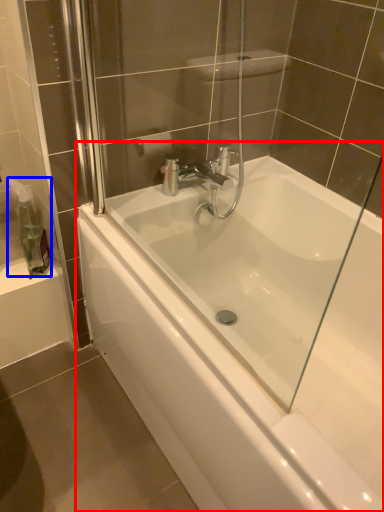
Question: Which of the following is the closest to the observer, bathtub (highlighted by a red box) or soap dispenser (highlighted by a blue box)?

Choices:
 (A) bathtub
 (B) soap dispenser

Answer: (A)